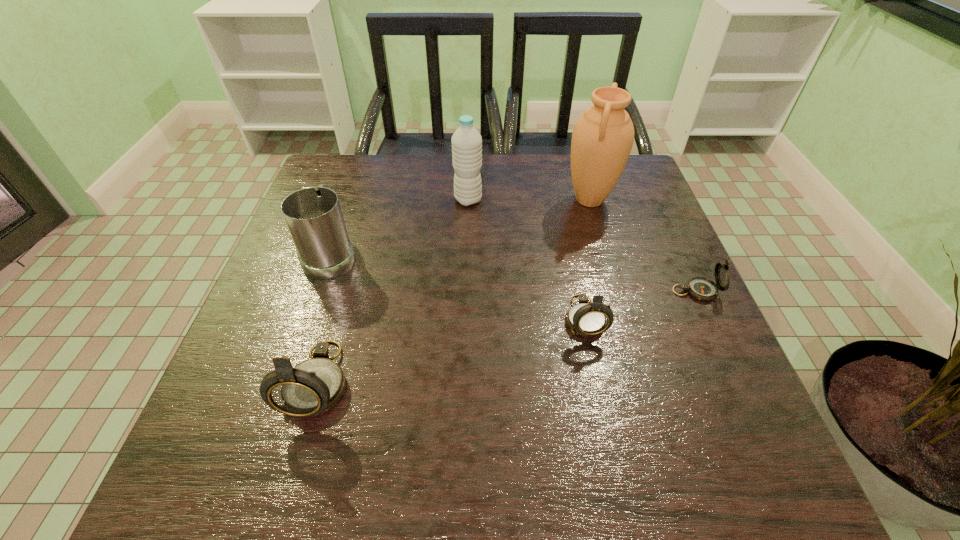
What are the coordinates of `compass at the right edge` in the screenshot? It's located at (701, 288).

Identify the location of urn at the right edge. (602, 139).

Identify the location of object that is at the near left corner. (314, 386).

Identify the location of object that is positioned at the far right corner. 602,139.

Where is `vacant space at the far edge of the desktop`? vacant space at the far edge of the desktop is located at coordinates (383, 176).

This screenshot has width=960, height=540. In the image, there is a desktop. In order to click on free space at the near edge in this screenshot , I will do `click(364, 395)`.

In the image, there is a desktop. Where is `free space at the left edge`? Image resolution: width=960 pixels, height=540 pixels. free space at the left edge is located at coordinates (286, 284).

The image size is (960, 540). In the image, there is a desktop. In order to click on free space at the right edge in this screenshot , I will do `click(642, 259)`.

You are a GUI agent. You are given a task and a screenshot of the screen. Output one action in this format:
    pyautogui.click(x=<x>, y=<y>)
    Task: Click on the free location at the far left corner
    The height and width of the screenshot is (540, 960).
    Given the screenshot: What is the action you would take?
    pyautogui.click(x=358, y=158)

In order to click on vacant space at the far right corner of the desktop in this screenshot , I will do `click(631, 197)`.